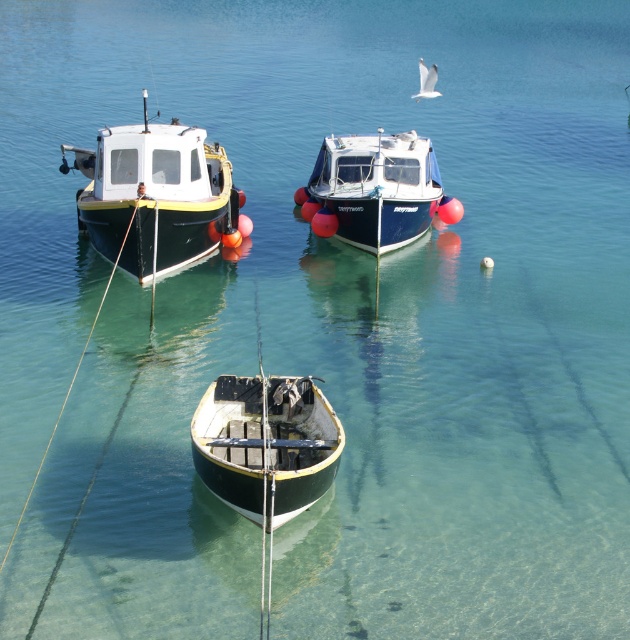
Question: Which object is the farthest from the green matte boat at center?

Choices:
 (A) matte black boat at left
 (B) blue glossy boat at center

Answer: (B)

Question: Is green matte boat at center to the right of blue glossy boat at center from the viewer's perspective?

Choices:
 (A) no
 (B) yes

Answer: (A)

Question: Which point is closer to the camera taking this photo?

Choices:
 (A) (321, 182)
 (B) (203, 426)

Answer: (B)

Question: Is matte black boat at left wider than green matte boat at center?

Choices:
 (A) yes
 (B) no

Answer: (A)

Question: Which object appears farthest from the camera in this image?

Choices:
 (A) green matte boat at center
 (B) matte black boat at left

Answer: (B)

Question: Can you confirm if matte black boat at left is positioned to the left of green matte boat at center?

Choices:
 (A) no
 (B) yes

Answer: (B)